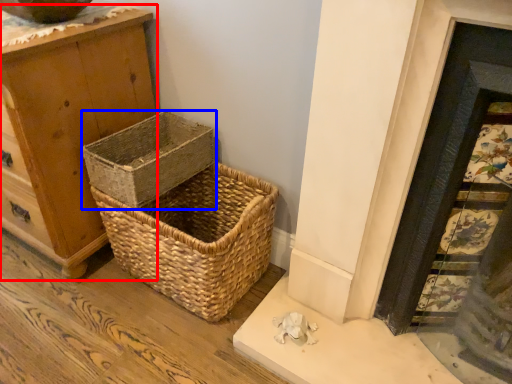
Question: Which object appears closest to the camera in this image, chest of drawers (highlighted by a red box) or picnic basket (highlighted by a blue box)?

Choices:
 (A) chest of drawers
 (B) picnic basket

Answer: (A)